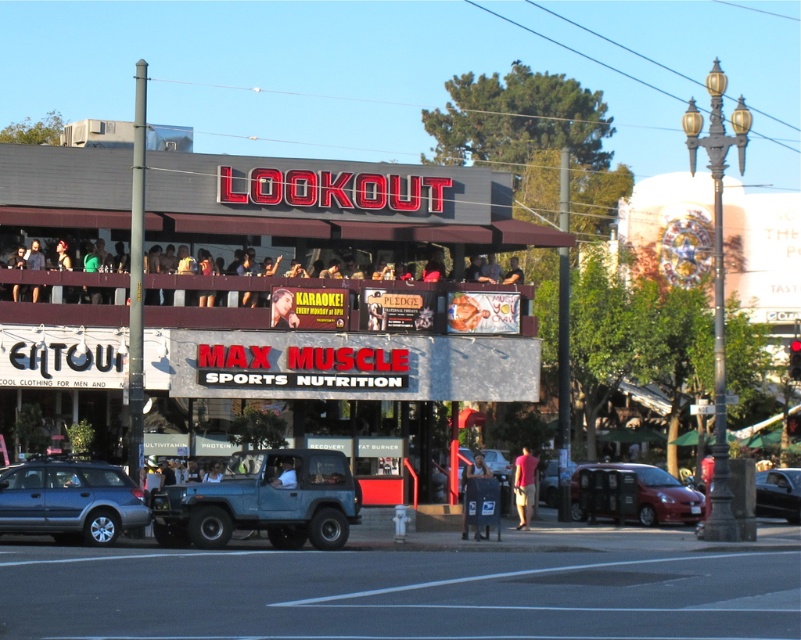
Does matte gray station wagon at lower left appear on the left side of smooth skin face at upper center?

Yes, matte gray station wagon at lower left is to the left of smooth skin face at upper center.

The image size is (801, 640). What are the coordinates of `matte gray station wagon at lower left` in the screenshot? It's located at (70, 500).

Where is `matte gray station wagon at lower left`? The image size is (801, 640). matte gray station wagon at lower left is located at coordinates (70, 500).

Can you confirm if metallic red car at lower right is wider than black glossy car at lower right?

Incorrect, metallic red car at lower right's width does not surpass black glossy car at lower right's.

Describe the element at coordinates (632, 493) in the screenshot. I see `metallic red car at lower right` at that location.

Describe the element at coordinates (632, 493) in the screenshot. The height and width of the screenshot is (640, 801). I see `metallic red car at lower right` at that location.

Where is `metallic red car at lower right`? The image size is (801, 640). metallic red car at lower right is located at coordinates (632, 493).

Does metallic silver car at center appear on the left side of smooth skin face at upper center?

No, metallic silver car at center is not to the left of smooth skin face at upper center.

Is metallic silver car at center taller than smooth skin face at upper center?

Indeed, metallic silver car at center has a greater height compared to smooth skin face at upper center.

Which is in front, point (541, 470) or point (276, 310)?

Point (276, 310) is in front.

The height and width of the screenshot is (640, 801). I want to click on metallic silver car at center, so click(552, 481).